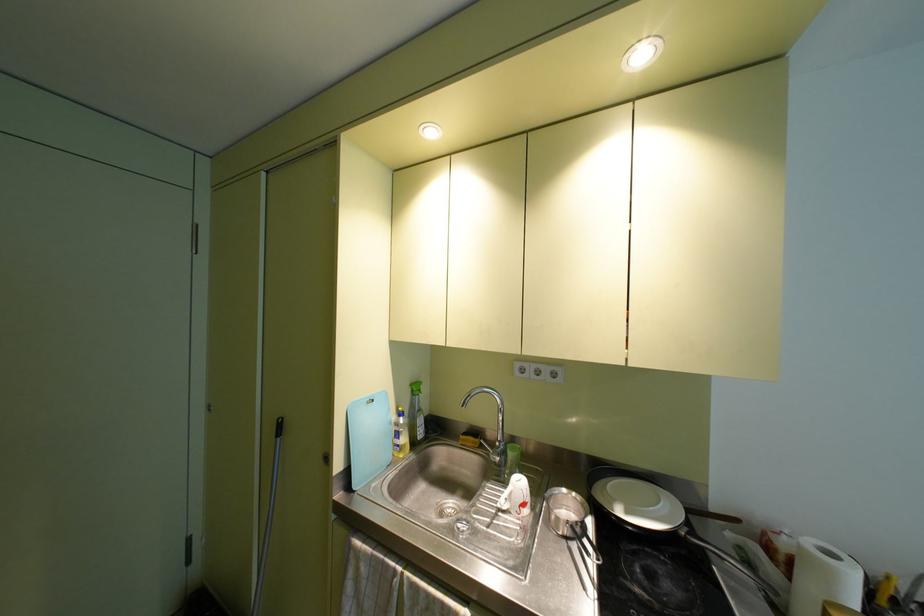
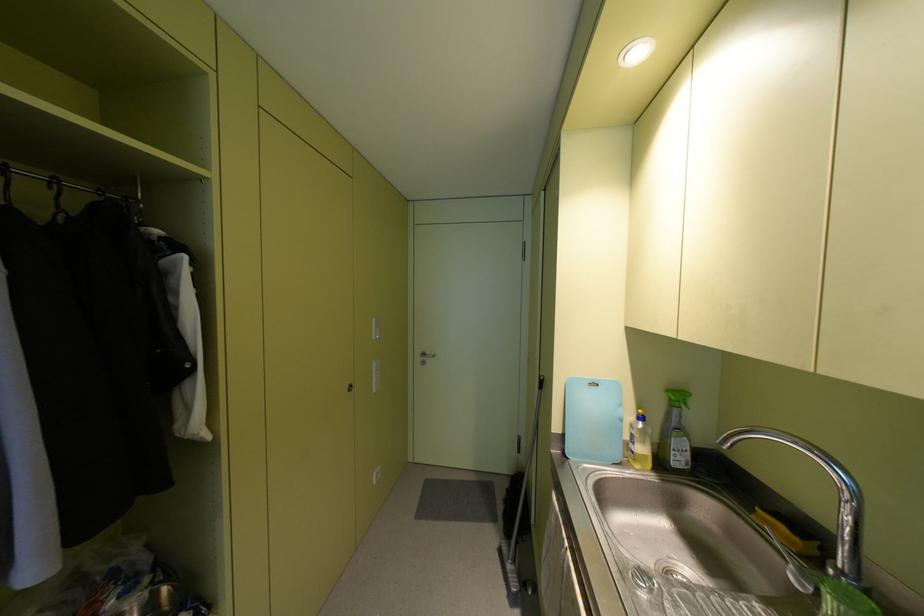
In the second image, find the point that corresponds to (399,413) in the first image.

(640, 416)